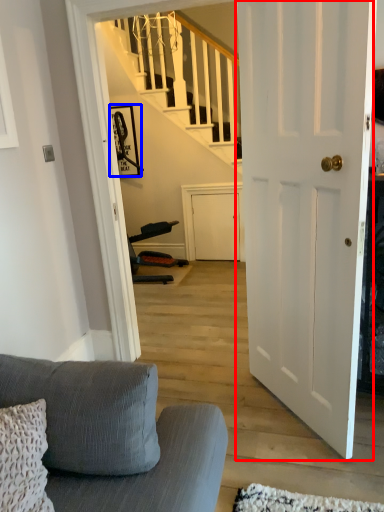
Question: Which object is further to the camera taking this photo, door (highlighted by a red box) or picture frame (highlighted by a blue box)?

Choices:
 (A) door
 (B) picture frame

Answer: (B)